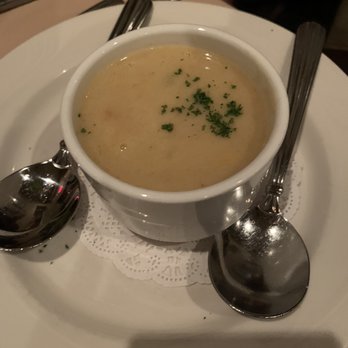
This screenshot has height=348, width=348. What are the coordinates of `top of bowl` in the screenshot? It's located at (x=172, y=16).